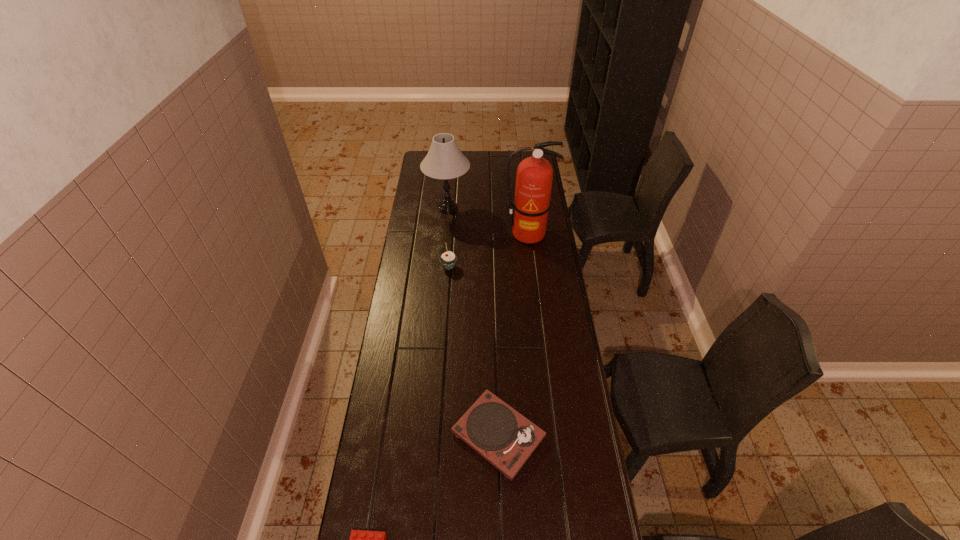
Find the location of a particular element. the second farthest object is located at coordinates (534, 176).

The width and height of the screenshot is (960, 540). Identify the location of fire extinguisher. (534, 176).

Image resolution: width=960 pixels, height=540 pixels. Find the location of `the second tallest object`. the second tallest object is located at coordinates (444, 160).

Where is `the farthest object`? The width and height of the screenshot is (960, 540). the farthest object is located at coordinates click(444, 160).

The height and width of the screenshot is (540, 960). I want to click on cupcake, so click(448, 259).

Where is `the third nearest object`? the third nearest object is located at coordinates (448, 259).

Identify the location of phonograph_record. The height and width of the screenshot is (540, 960). (505, 438).

This screenshot has width=960, height=540. I want to click on the fourth farthest object, so click(505, 438).

Find the location of `free space located 0.190m on the side of the fourth nearest object with the nozzle and handle`. free space located 0.190m on the side of the fourth nearest object with the nozzle and handle is located at coordinates (532, 273).

Locate an element on the screen. Image resolution: width=960 pixels, height=540 pixels. free space located 0.050m on the left of the second tallest object is located at coordinates (416, 208).